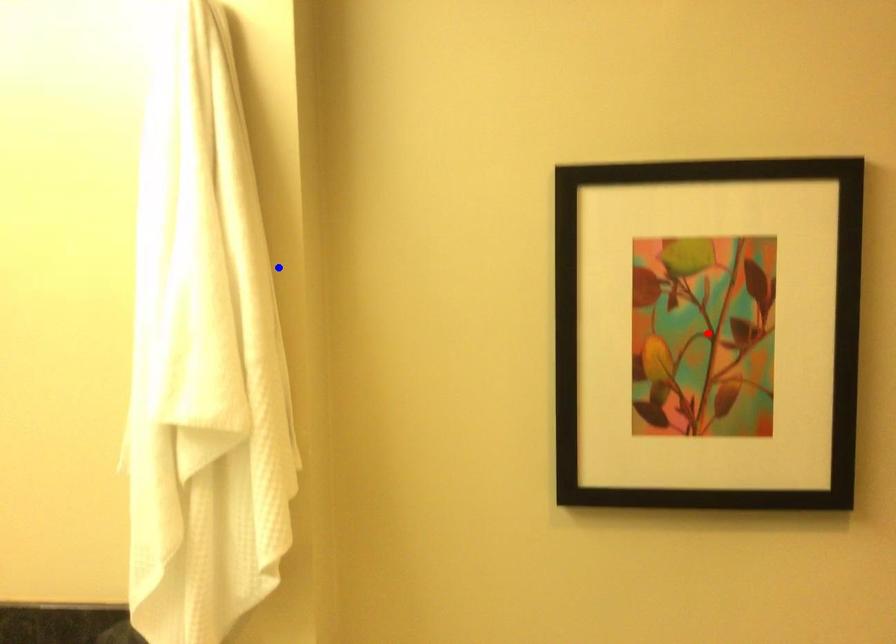
Question: In the image, two points are highlighted. Which point is nearer to the camera? Reply with the corresponding letter.

Choices:
 (A) blue point
 (B) red point

Answer: (A)